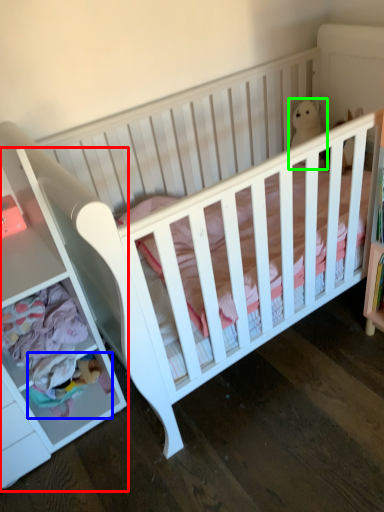
Question: Estimate the real-world distances between objects in this image. Which object is closer to dresser (highlighted by a red box), toy (highlighted by a blue box) or animal (highlighted by a green box)?

Choices:
 (A) toy
 (B) animal

Answer: (A)